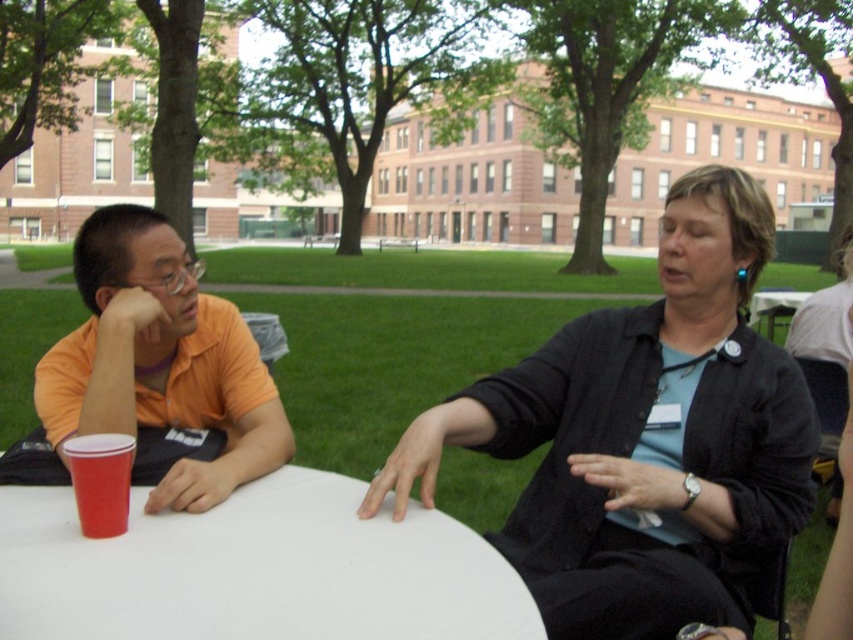
Question: Observing the image, what is the correct spatial positioning of black fabric jacket at center in reference to matte plastic cup at table left?

Choices:
 (A) right
 (B) left

Answer: (A)

Question: Where is white smooth table at center located in relation to orange matte shirt at left in the image?

Choices:
 (A) below
 (B) above

Answer: (A)

Question: Does white smooth table at center have a larger size compared to orange matte shirt at left?

Choices:
 (A) no
 (B) yes

Answer: (A)

Question: Which of the following is the closest to the observer?

Choices:
 (A) (292, 492)
 (B) (397, 490)
 (C) (142, 376)
 (D) (85, 442)

Answer: (D)

Question: Which point is farther to the camera?

Choices:
 (A) (148, 428)
 (B) (97, 509)

Answer: (A)

Question: Which object is positioned closest to the matte plastic cup at table left?

Choices:
 (A) orange matte shirt at left
 (B) white smooth table at center

Answer: (A)